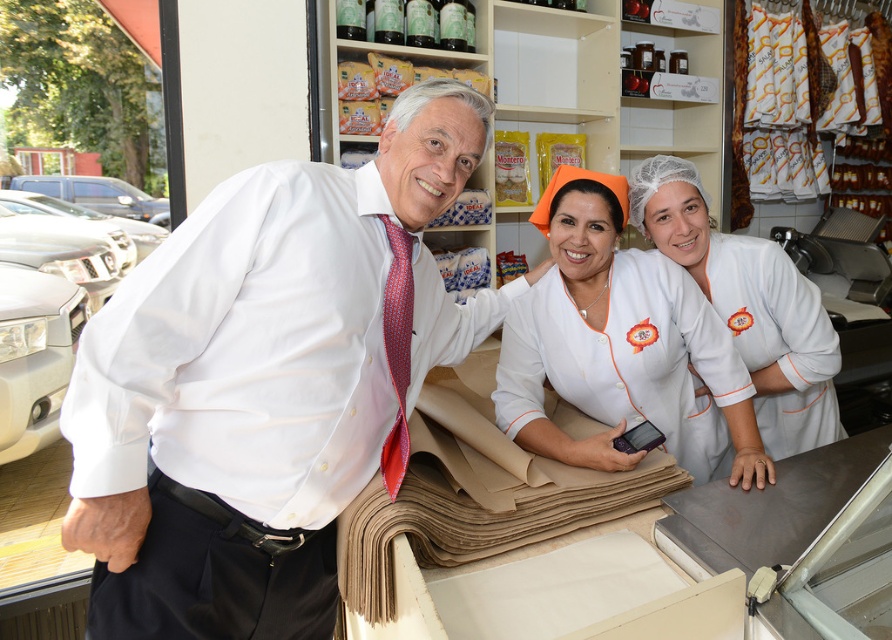
Question: Which object is the farthest from the white smooth shirt at center?

Choices:
 (A) white fabric uniform at center
 (B) white fabric at center

Answer: (A)

Question: Which of the following is the closest to the observer?

Choices:
 (A) (692, 218)
 (B) (431, 426)
 (C) (601, 364)

Answer: (B)

Question: Which of the following is the closest to the observer?

Choices:
 (A) brown paper at center
 (B) white fabric uniform at center

Answer: (A)

Question: Is white smooth shirt at center to the left of white fabric at center from the viewer's perspective?

Choices:
 (A) no
 (B) yes

Answer: (B)

Question: Does white smooth shirt at center appear under white fabric uniform at center?

Choices:
 (A) no
 (B) yes

Answer: (B)

Question: Is white smooth shirt at center to the left of white fabric uniform at center from the viewer's perspective?

Choices:
 (A) yes
 (B) no

Answer: (A)